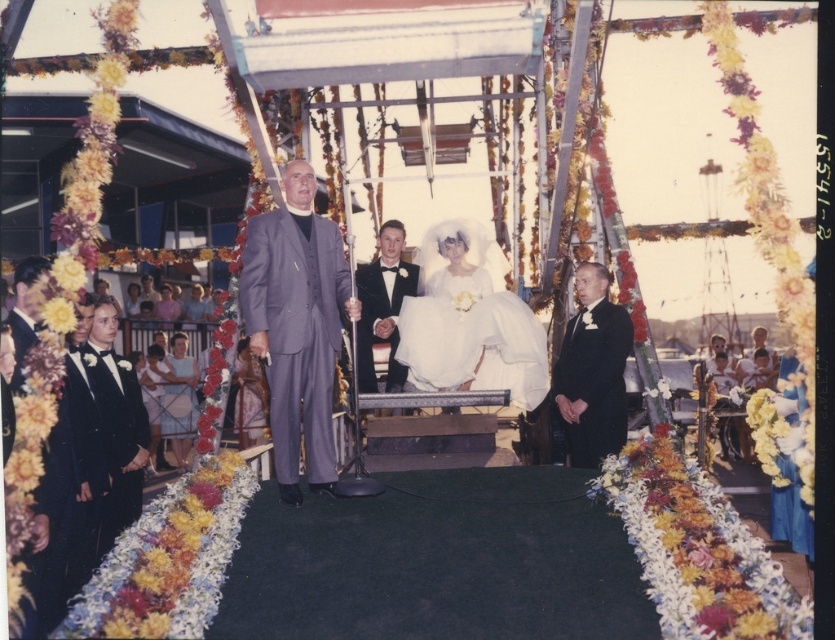
Which is in front, point (277, 339) or point (463, 296)?

Positioned in front is point (277, 339).

Can you confirm if matte gray suit at center is positioned above white satin dress at center?

No, matte gray suit at center is not above white satin dress at center.

The width and height of the screenshot is (835, 640). What do you see at coordinates (297, 328) in the screenshot?
I see `matte gray suit at center` at bounding box center [297, 328].

You are a GUI agent. You are given a task and a screenshot of the screen. Output one action in this format:
    pyautogui.click(x=<x>, y=<y>)
    Task: Click on the matte gray suit at center
    This screenshot has width=835, height=640.
    Given the screenshot: What is the action you would take?
    pyautogui.click(x=297, y=328)

Identify the location of white satin dress at center. (469, 324).

Does white satin dress at center appear under black satin tuxedo at center?

Yes.

Measure the distance between point (449, 358) and camera.

7.42 meters

This screenshot has height=640, width=835. In order to click on white satin dress at center in this screenshot , I will do `click(469, 324)`.

Is point (269, 266) less distant than point (122, 381)?

Yes, point (269, 266) is closer to viewer.

Between matte gray suit at center and black satin tuxedo at left, which one has less height?

black satin tuxedo at left

Which is behind, point (312, 317) or point (114, 433)?

Point (114, 433)

The height and width of the screenshot is (640, 835). Find the location of `matte gray suit at center`. matte gray suit at center is located at coordinates (297, 328).